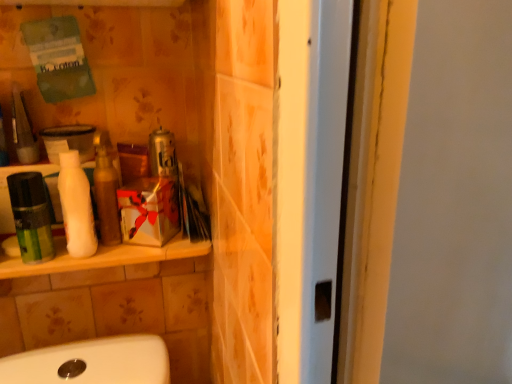
Question: Is green matte mouthwash at left wider than white matte lotion at left?

Choices:
 (A) no
 (B) yes

Answer: (A)

Question: Is green matte mouthwash at left turned away from white matte lotion at left?

Choices:
 (A) no
 (B) yes

Answer: (A)

Question: Can you confirm if green matte mouthwash at left is taller than white matte lotion at left?

Choices:
 (A) no
 (B) yes

Answer: (A)

Question: Is the position of green matte mouthwash at left more distant than that of white matte lotion at left?

Choices:
 (A) no
 (B) yes

Answer: (A)

Question: Can you confirm if green matte mouthwash at left is shorter than white matte lotion at left?

Choices:
 (A) yes
 (B) no

Answer: (A)

Question: Is green matte mouthwash at left far away from white matte lotion at left?

Choices:
 (A) yes
 (B) no

Answer: (B)

Question: Is the position of green matte mouthwash at left less distant than that of metallic can at center?

Choices:
 (A) no
 (B) yes

Answer: (B)

Question: Does green matte mouthwash at left come behind metallic can at center?

Choices:
 (A) no
 (B) yes

Answer: (A)

Question: Considering the relative sizes of green matte mouthwash at left and metallic can at center in the image provided, is green matte mouthwash at left taller than metallic can at center?

Choices:
 (A) yes
 (B) no

Answer: (A)

Question: Is metallic can at center a part of green matte mouthwash at left?

Choices:
 (A) yes
 (B) no

Answer: (B)

Question: Is the surface of green matte mouthwash at left in direct contact with metallic can at center?

Choices:
 (A) yes
 (B) no

Answer: (B)

Question: Can you confirm if green matte mouthwash at left is positioned to the left of metallic can at center?

Choices:
 (A) yes
 (B) no

Answer: (A)

Question: Is white matte bottle at left positioned beyond the bounds of metallic can at center?

Choices:
 (A) no
 (B) yes

Answer: (B)